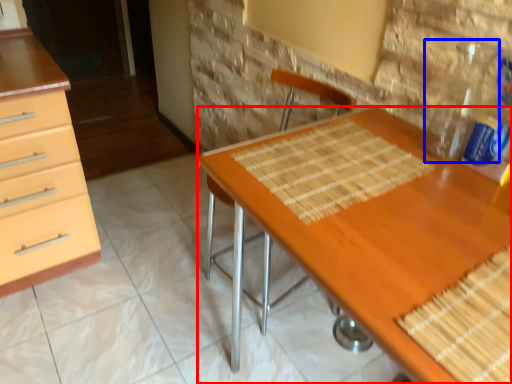
Question: Which object is further to the camera taking this photo, desk (highlighted by a red box) or bottle (highlighted by a blue box)?

Choices:
 (A) desk
 (B) bottle

Answer: (B)